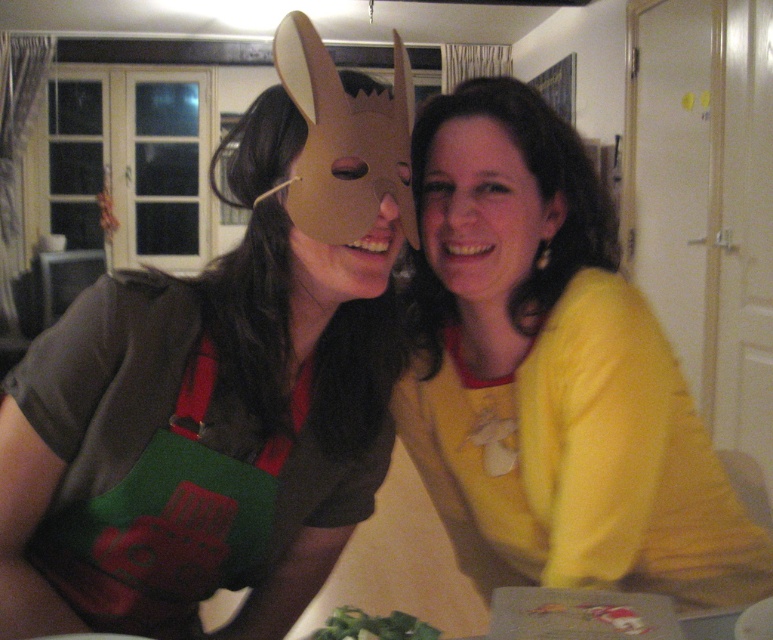
Is matte yellow shirt at center shorter than green leafy vegetable at lower center?

In fact, matte yellow shirt at center may be taller than green leafy vegetable at lower center.

Which is above, matte yellow shirt at center or green leafy vegetable at lower center?

Positioned higher is matte yellow shirt at center.

This screenshot has height=640, width=773. What do you see at coordinates (482, 212) in the screenshot?
I see `matte yellow shirt at center` at bounding box center [482, 212].

Find the location of a particular element. matte yellow shirt at center is located at coordinates (482, 212).

Is matte brown mask at upper left below matte cardboard mask at center?

Indeed, matte brown mask at upper left is positioned under matte cardboard mask at center.

Between matte brown mask at upper left and matte cardboard mask at center, which one is positioned lower?

matte brown mask at upper left is below.

What do you see at coordinates (220, 385) in the screenshot?
I see `matte brown mask at upper left` at bounding box center [220, 385].

Identify the location of matte brown mask at upper left. The height and width of the screenshot is (640, 773). (220, 385).

Can you confirm if matte yellow shirt at center is bigger than matte cardboard mask at center?

Yes, matte yellow shirt at center is bigger than matte cardboard mask at center.

Find the location of a particular element. matte yellow shirt at center is located at coordinates (482, 212).